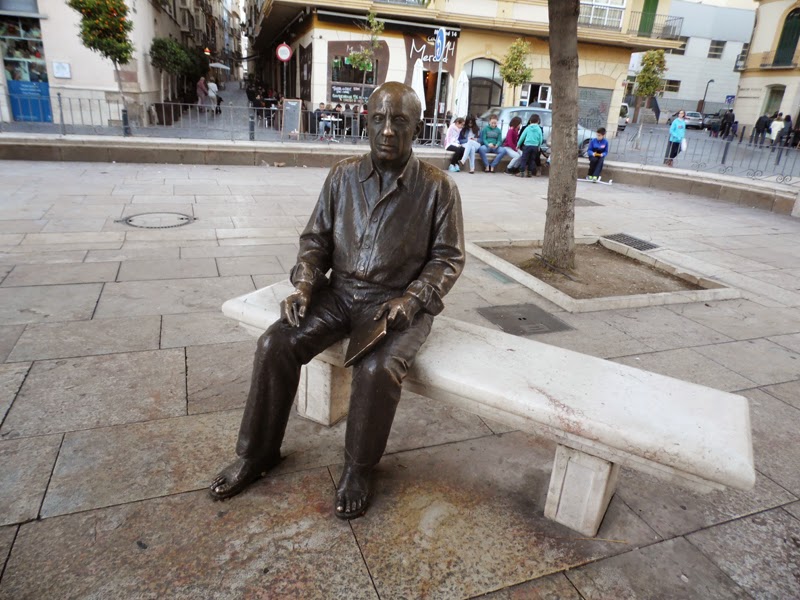
You are a GUI agent. You are given a task and a screenshot of the screen. Output one action in this format:
    pyautogui.click(x=<x>, y=<y>)
    Task: Click on the statue's hand
    
    Given the screenshot: What is the action you would take?
    pyautogui.click(x=297, y=294), pyautogui.click(x=402, y=308)